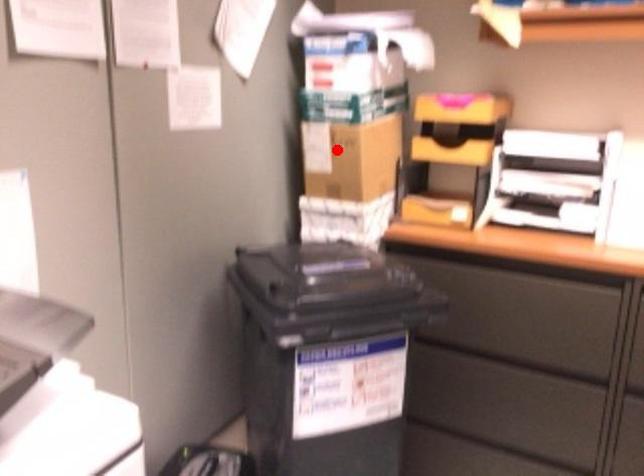
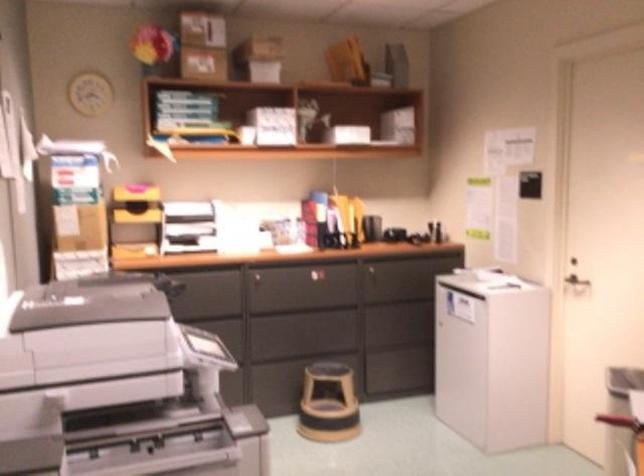
Question: I am providing you with two images of the same scene from different viewpoints. In image1, a red point is highlighted. Considering the same 3D point in image2, which of the following is correct?

Choices:
 (A) It is closer
 (B) It is farther

Answer: (B)